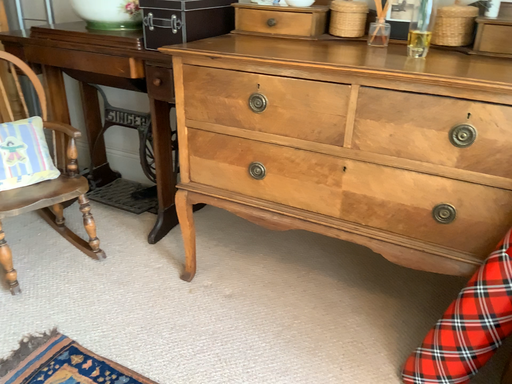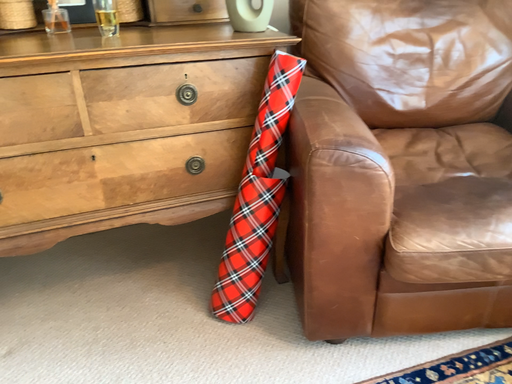
Question: Which way did the camera rotate in the video?

Choices:
 (A) rotated left
 (B) rotated right

Answer: (B)